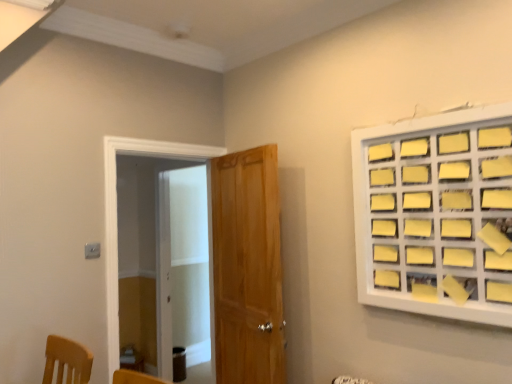
Question: From the image's perspective, relative to wooden door at center, is transparent glass screen door at left above or below?

Choices:
 (A) above
 (B) below

Answer: (A)

Question: From a real-world perspective, relative to wooden door at center, is transparent glass screen door at left vertically above or below?

Choices:
 (A) below
 (B) above

Answer: (B)

Question: Which object is the closest to the wooden door at center?

Choices:
 (A) yellow paper at upper right
 (B) transparent glass screen door at left

Answer: (A)

Question: Which is farther from the wooden door at center?

Choices:
 (A) yellow paper at upper right
 (B) transparent glass screen door at left

Answer: (B)